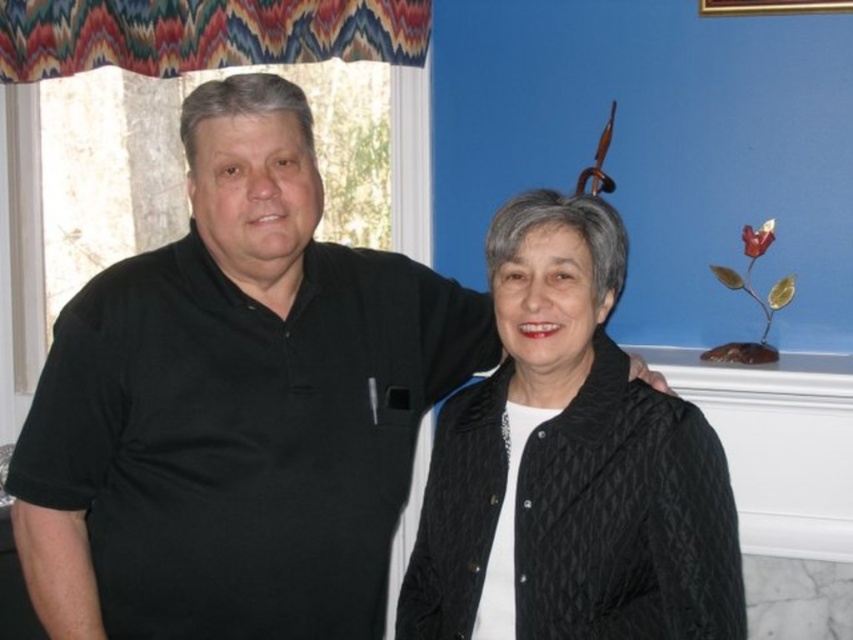
Is black matte shirt at left in front of gold wooden picture frame at upper right?

Yes, it is in front of gold wooden picture frame at upper right.

Which is in front, point (136, 433) or point (814, 3)?

Point (136, 433) is in front.

Locate an element on the screen. This screenshot has height=640, width=853. black matte shirt at left is located at coordinates (235, 404).

Which is more to the right, black quilted jacket at center or gold wooden picture frame at upper right?

From the viewer's perspective, gold wooden picture frame at upper right appears more on the right side.

In the scene shown: Is black quilted jacket at center further to camera compared to gold wooden picture frame at upper right?

No, it is in front of gold wooden picture frame at upper right.

Between point (740, 580) and point (733, 8), which one is positioned behind?

Point (733, 8)

Where is `black quilted jacket at center`? The height and width of the screenshot is (640, 853). black quilted jacket at center is located at coordinates (569, 467).

In the scene shown: Does black matte shirt at left appear over black quilted jacket at center?

Indeed, black matte shirt at left is positioned over black quilted jacket at center.

This screenshot has width=853, height=640. Describe the element at coordinates (235, 404) in the screenshot. I see `black matte shirt at left` at that location.

What do you see at coordinates (235, 404) in the screenshot? The image size is (853, 640). I see `black matte shirt at left` at bounding box center [235, 404].

The width and height of the screenshot is (853, 640). I want to click on black matte shirt at left, so click(235, 404).